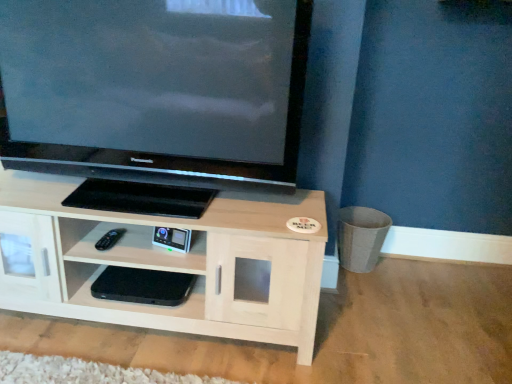
The image size is (512, 384). What do you see at coordinates (110, 239) in the screenshot?
I see `black plastic remote at lower left` at bounding box center [110, 239].

Measure the distance between point (105, 242) and camera.

Point (105, 242) is 1.56 meters from camera.

Describe the element at coordinates (170, 263) in the screenshot. I see `light wood shelf at center, the first shelf from the top` at that location.

In order to click on matte black television at upper left in this screenshot , I will do `click(155, 98)`.

In order to face matte black television at upper left, should I rotate leftwards or rightwards?

A 14.990 degree turn to the left will do.

Where is `black matte console at center, which ranks as the first shelf in bottom-to-top order`? black matte console at center, which ranks as the first shelf in bottom-to-top order is located at coordinates (124, 302).

The height and width of the screenshot is (384, 512). What are the coordinates of `black plastic remote at lower left` in the screenshot? It's located at (110, 239).

Considering the sizes of objects light wood shelf at center, the first shelf from the top, and matte black television at upper left in the image provided, who is bigger, light wood shelf at center, the first shelf from the top, or matte black television at upper left?

light wood shelf at center, the first shelf from the top.

Is light wood shelf at center, the first shelf from the top, surrounding matte black television at upper left?

No, matte black television at upper left is not surrounded by light wood shelf at center, the first shelf from the top.

Is light wood shelf at center, the first shelf from the top, in front of or behind matte black television at upper left in the image?

light wood shelf at center, the first shelf from the top, is behind matte black television at upper left.

Considering the relative sizes of light wood shelf at center, the first shelf from the top, and matte black television at upper left in the image provided, is light wood shelf at center, the first shelf from the top, wider than matte black television at upper left?

Yes, light wood shelf at center, the first shelf from the top, is wider than matte black television at upper left.

This screenshot has width=512, height=384. What are the coordinates of `shelf above the black matte console at center, the 2th shelf positioned from the top (from a real-world perspective)` in the screenshot? It's located at (170, 263).

Considering the relative sizes of black matte console at center, the 2th shelf positioned from the top, and light wood shelf at center, acting as the 2th shelf starting from the bottom, in the image provided, is black matte console at center, the 2th shelf positioned from the top, taller than light wood shelf at center, acting as the 2th shelf starting from the bottom,?

Incorrect, the height of black matte console at center, the 2th shelf positioned from the top, is not larger of that of light wood shelf at center, acting as the 2th shelf starting from the bottom.

From the image's perspective, between black matte console at center, which ranks as the first shelf in bottom-to-top order, and light wood shelf at center, the first shelf from the top, which one is located above?

light wood shelf at center, the first shelf from the top, from the image's perspective.

Would you consider black matte console at center, which ranks as the first shelf in bottom-to-top order, to be distant from light wood shelf at center, acting as the 2th shelf starting from the bottom?

No, there isn't a large distance between black matte console at center, which ranks as the first shelf in bottom-to-top order, and light wood shelf at center, acting as the 2th shelf starting from the bottom.

Can you confirm if black plastic remote at lower left is wider than light wood shelf at center, acting as the 2th shelf starting from the bottom?

In fact, black plastic remote at lower left might be narrower than light wood shelf at center, acting as the 2th shelf starting from the bottom.

Is black plastic remote at lower left not close to light wood shelf at center, the first shelf from the top?

No, black plastic remote at lower left is not far from light wood shelf at center, the first shelf from the top.

Considering the sizes of black plastic remote at lower left and light wood shelf at center, acting as the 2th shelf starting from the bottom, in the image, is black plastic remote at lower left taller or shorter than light wood shelf at center, acting as the 2th shelf starting from the bottom,?

In the image, black plastic remote at lower left appears to be shorter than light wood shelf at center, acting as the 2th shelf starting from the bottom.

Does black plastic remote at lower left have a larger size compared to light wood shelf at center, the first shelf from the top?

No, black plastic remote at lower left is not bigger than light wood shelf at center, the first shelf from the top.

Which is in front, black plastic remote at lower left or black matte console at center, the 2th shelf positioned from the top?

black matte console at center, the 2th shelf positioned from the top, is closer to the camera.

Which is behind, point (109, 243) or point (99, 274)?

The point (109, 243) is more distant.

How different are the orientations of black plastic remote at lower left and black matte console at center, the 2th shelf positioned from the top, in degrees?

They differ by 0.000503 degrees in their facing directions.

Can you confirm if black matte console at center, which ranks as the first shelf in bottom-to-top order, is wider than black plastic remote at lower left?

Yes, black matte console at center, which ranks as the first shelf in bottom-to-top order, is wider than black plastic remote at lower left.

From the picture: From the image's perspective, is black matte console at center, which ranks as the first shelf in bottom-to-top order, above or below black plastic remote at lower left?

From the image's perspective, black matte console at center, which ranks as the first shelf in bottom-to-top order, appears below black plastic remote at lower left.

Can black plastic remote at lower left be found inside black matte console at center, the 2th shelf positioned from the top?

No, black plastic remote at lower left is not inside black matte console at center, the 2th shelf positioned from the top.

From a real-world perspective, which object rests below the other?

From a 3D spatial view, black plastic remote at lower left is below.

Can you confirm if matte black television at upper left is bigger than black plastic remote at lower left?

Correct, matte black television at upper left is larger in size than black plastic remote at lower left.

Is black plastic remote at lower left at the back of matte black television at upper left?

No, black plastic remote at lower left is not at the back of matte black television at upper left.

Consider the image. Is matte black television at upper left wider or thinner than black plastic remote at lower left?

matte black television at upper left is wider than black plastic remote at lower left.

Where is `the 2nd shelf below the matte black television at upper left (from the image's perspective)`? The height and width of the screenshot is (384, 512). the 2nd shelf below the matte black television at upper left (from the image's perspective) is located at coordinates (124, 302).

Based on their sizes in the image, would you say black matte console at center, which ranks as the first shelf in bottom-to-top order, is bigger or smaller than matte black television at upper left?

Clearly, black matte console at center, which ranks as the first shelf in bottom-to-top order, is smaller in size than matte black television at upper left.

Is black matte console at center, the 2th shelf positioned from the top, beside matte black television at upper left?

black matte console at center, the 2th shelf positioned from the top, and matte black television at upper left are clearly separated.

In terms of width, does black matte console at center, the 2th shelf positioned from the top, look wider or thinner when compared to matte black television at upper left?

Clearly, black matte console at center, the 2th shelf positioned from the top, has less width compared to matte black television at upper left.

Image resolution: width=512 pixels, height=384 pixels. In order to click on television on the right of light wood shelf at center, acting as the 2th shelf starting from the bottom in this screenshot , I will do `click(155, 98)`.

The width and height of the screenshot is (512, 384). I want to click on shelf behind the light wood shelf at center, the first shelf from the top, so click(x=124, y=302).

When comparing their distances from black plastic remote at lower left, does matte black television at upper left or light wood shelf at center, the first shelf from the top, seem further?

matte black television at upper left is positioned further to the anchor black plastic remote at lower left.

Which object lies nearer to the anchor point black plastic remote at lower left, light wood shelf at center, the first shelf from the top, or matte black television at upper left?

light wood shelf at center, the first shelf from the top, lies closer to black plastic remote at lower left than the other object.

Based on their spatial positions, is black plastic remote at lower left or black matte console at center, which ranks as the first shelf in bottom-to-top order, closer to matte black television at upper left?

The object closer to matte black television at upper left is black matte console at center, which ranks as the first shelf in bottom-to-top order.

Looking at the image, which one is located closer to matte black television at upper left, light wood shelf at center, the first shelf from the top, or black matte console at center, which ranks as the first shelf in bottom-to-top order?

light wood shelf at center, the first shelf from the top, is positioned closer to the anchor matte black television at upper left.

When comparing their distances from black plastic remote at lower left, does black matte console at center, which ranks as the first shelf in bottom-to-top order, or matte black television at upper left seem closer?

Based on the image, black matte console at center, which ranks as the first shelf in bottom-to-top order, appears to be nearer to black plastic remote at lower left.

Looking at the image, which one is located further to light wood shelf at center, acting as the 2th shelf starting from the bottom, black matte console at center, the 2th shelf positioned from the top, or black plastic remote at lower left?

black plastic remote at lower left is positioned further to the anchor light wood shelf at center, acting as the 2th shelf starting from the bottom.

Looking at the image, which one is located closer to black matte console at center, which ranks as the first shelf in bottom-to-top order, light wood shelf at center, the first shelf from the top, or black plastic remote at lower left?

light wood shelf at center, the first shelf from the top, lies closer to black matte console at center, which ranks as the first shelf in bottom-to-top order, than the other object.

Based on their spatial positions, is black matte console at center, the 2th shelf positioned from the top, or light wood shelf at center, the first shelf from the top, closer to black plastic remote at lower left?

black matte console at center, the 2th shelf positioned from the top, is closer to black plastic remote at lower left.

This screenshot has height=384, width=512. What are the coordinates of `shelf that lies between matte black television at upper left and black matte console at center, which ranks as the first shelf in bottom-to-top order, from top to bottom` in the screenshot? It's located at (170, 263).

Where is `remote that lies between matte black television at upper left and black matte console at center, which ranks as the first shelf in bottom-to-top order, from top to bottom`? This screenshot has height=384, width=512. remote that lies between matte black television at upper left and black matte console at center, which ranks as the first shelf in bottom-to-top order, from top to bottom is located at coordinates (110, 239).

The height and width of the screenshot is (384, 512). What are the coordinates of `shelf between light wood shelf at center, acting as the 2th shelf starting from the bottom, and black plastic remote at lower left in the front-back direction` in the screenshot? It's located at coord(124,302).

I want to click on remote between matte black television at upper left and light wood shelf at center, the first shelf from the top, in the up-down direction, so click(110, 239).